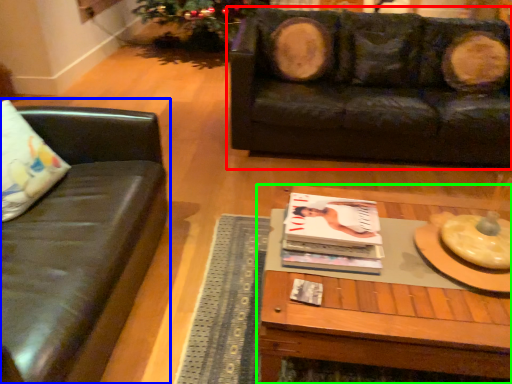
Question: Considering the real-world distances, which object is farthest from studio couch (highlighted by a red box)? studio couch (highlighted by a blue box) or coffee table (highlighted by a green box)?

Choices:
 (A) studio couch
 (B) coffee table

Answer: (A)